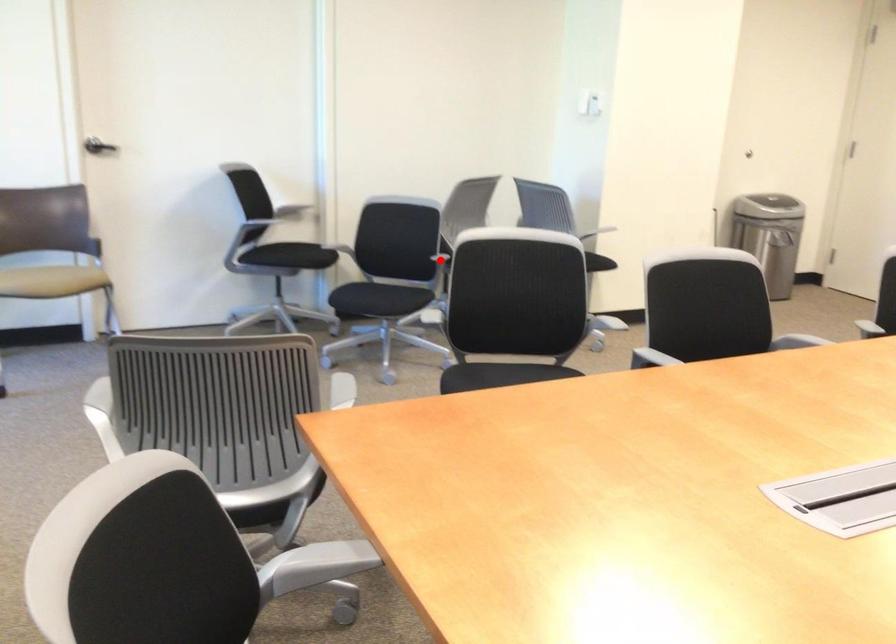
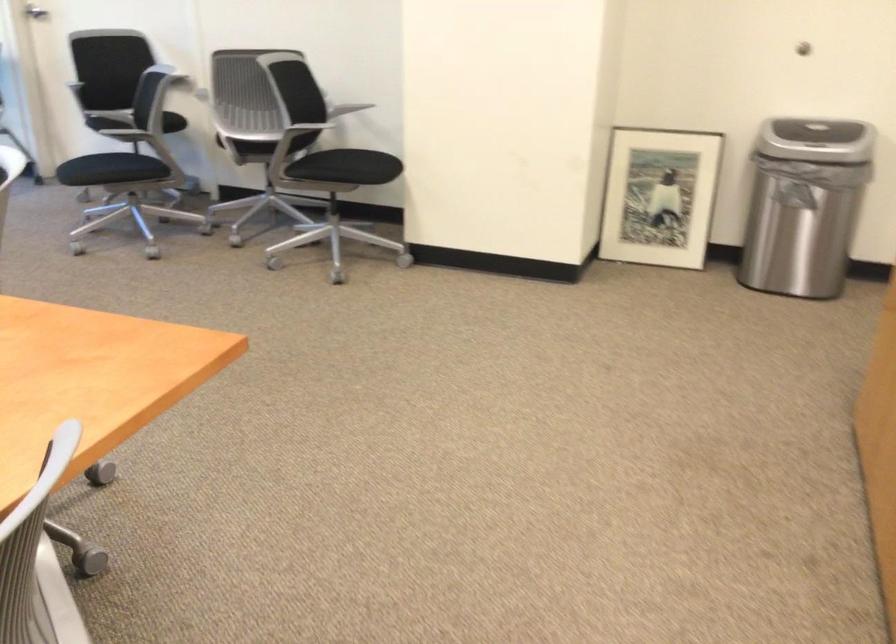
Question: I am providing you with two images of the same scene from different viewpoints. A red point is marked on the first image. Can you still see the location of the red point in image 2?

Choices:
 (A) Yes
 (B) No

Answer: (B)